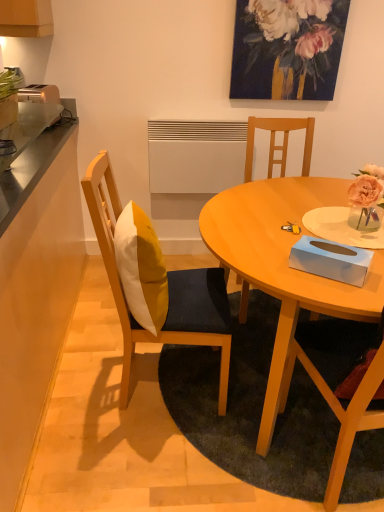
Question: Is yellow fabric pillow at center in front of matte wood table at center?

Choices:
 (A) no
 (B) yes

Answer: (A)

Question: Can you confirm if yellow fabric pillow at center is shorter than matte wood table at center?

Choices:
 (A) yes
 (B) no

Answer: (A)

Question: Could you tell me if yellow fabric pillow at center is turned towards matte wood table at center?

Choices:
 (A) no
 (B) yes

Answer: (B)

Question: From the image's perspective, would you say yellow fabric pillow at center is positioned over matte wood table at center?

Choices:
 (A) no
 (B) yes

Answer: (B)

Question: Considering the relative sizes of yellow fabric pillow at center and matte wood table at center in the image provided, is yellow fabric pillow at center thinner than matte wood table at center?

Choices:
 (A) yes
 (B) no

Answer: (A)

Question: Can matte wood table at center be found inside yellow fabric pillow at center?

Choices:
 (A) no
 (B) yes

Answer: (A)

Question: Does wooden chair at right, which is counted as the 1th chair, starting from the right, have a smaller size compared to metallic silver toaster at left?

Choices:
 (A) yes
 (B) no

Answer: (B)

Question: Does wooden chair at right, which is counted as the 1th chair, starting from the right, come behind metallic silver toaster at left?

Choices:
 (A) no
 (B) yes

Answer: (A)

Question: Can you see wooden chair at right, which is counted as the 1th chair, starting from the right, touching metallic silver toaster at left?

Choices:
 (A) yes
 (B) no

Answer: (B)

Question: Is wooden chair at right, which appears as the 3th chair when viewed from the left, positioned far away from metallic silver toaster at left?

Choices:
 (A) yes
 (B) no

Answer: (A)

Question: Considering the relative positions of wooden chair at right, which appears as the 3th chair when viewed from the left, and metallic silver toaster at left in the image provided, is wooden chair at right, which appears as the 3th chair when viewed from the left, to the right of metallic silver toaster at left from the viewer's perspective?

Choices:
 (A) yes
 (B) no

Answer: (A)

Question: Is wooden chair at right, which is counted as the 1th chair, starting from the right, completely or partially outside of metallic silver toaster at left?

Choices:
 (A) no
 (B) yes

Answer: (B)

Question: Considering the relative sizes of painted floral arrangement at upper center and metallic stainless steel counter top at left, which appears as the 1th counter top when viewed from the right, in the image provided, is painted floral arrangement at upper center taller than metallic stainless steel counter top at left, which appears as the 1th counter top when viewed from the right,?

Choices:
 (A) no
 (B) yes

Answer: (B)